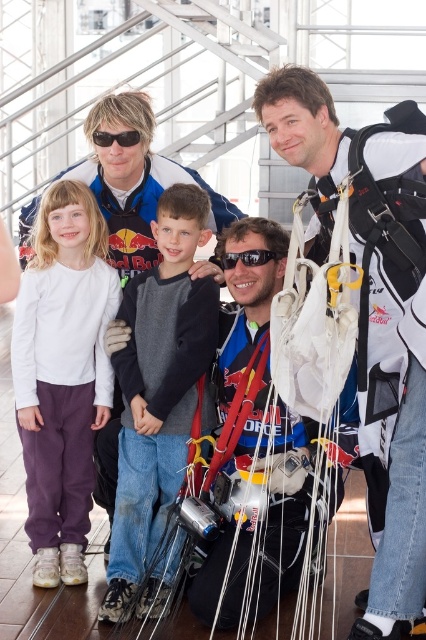
Question: Which point is farther from the camera taking this photo?

Choices:
 (A) (152, 396)
 (B) (54, 289)
 (C) (374, 385)
 (D) (268, 253)

Answer: (B)

Question: Does white soft shirt at center appear over black plastic goggles at center?

Choices:
 (A) no
 (B) yes

Answer: (A)

Question: Where is white soft shirt at center located in relation to gray cotton hoodie at center in the image?

Choices:
 (A) below
 (B) above

Answer: (B)

Question: From the image, what is the correct spatial relationship of white parachute at right in relation to black plastic sunglasses at upper left?

Choices:
 (A) below
 (B) above

Answer: (A)

Question: Considering the real-world distances, which object is farthest from the black plastic goggles at center?

Choices:
 (A) white soft shirt at center
 (B) black plastic sunglasses at upper left

Answer: (A)

Question: Which point appears closest to the camera in this image?

Choices:
 (A) (66, 336)
 (B) (123, 131)

Answer: (A)